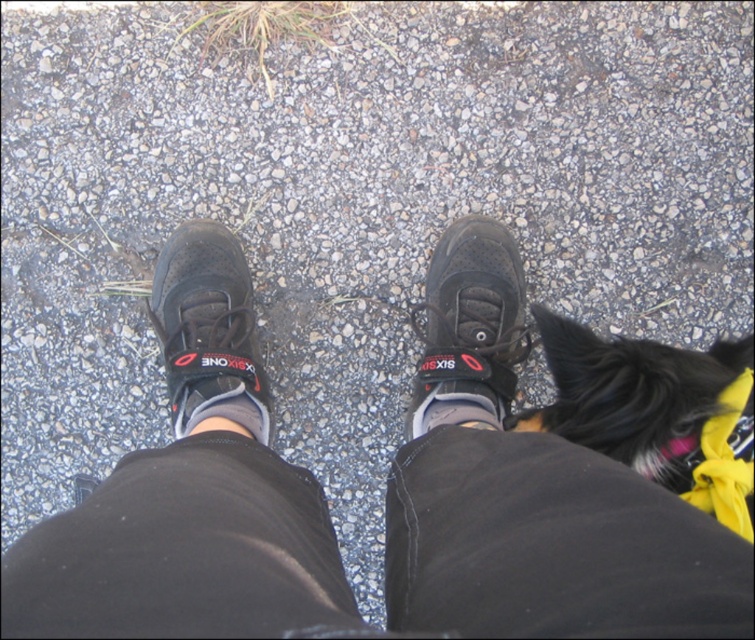
You are a delivery drone operator. Your drone is hovering 16 inches above the ground. You need to land it on the black mesh sneakers at center. Is the drone within landing range?

The black mesh sneakers at center are 15.76 inches away from the viewer, so the drone hovering at 16 inches is just within landing range.

What are the coordinates of the black mesh sneakers at center?

The black mesh sneakers at center are located at point (190, 496).